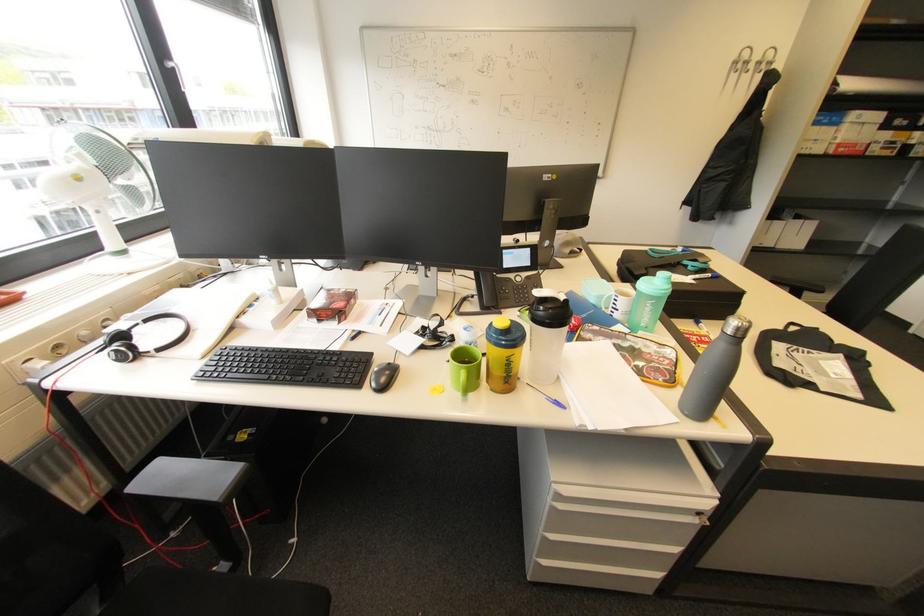
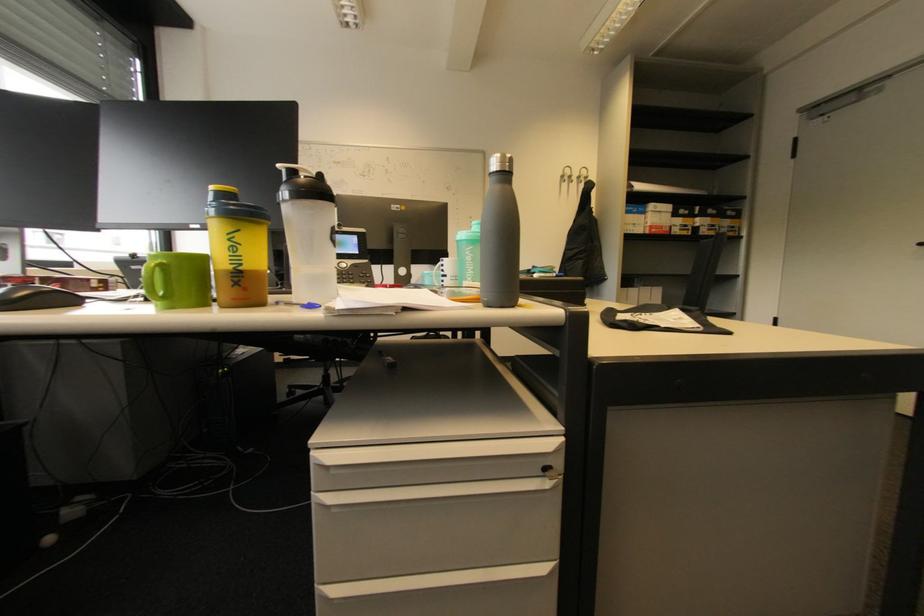
Where in the second image is the point corresponding to [511,384] from the first image?

(239, 286)